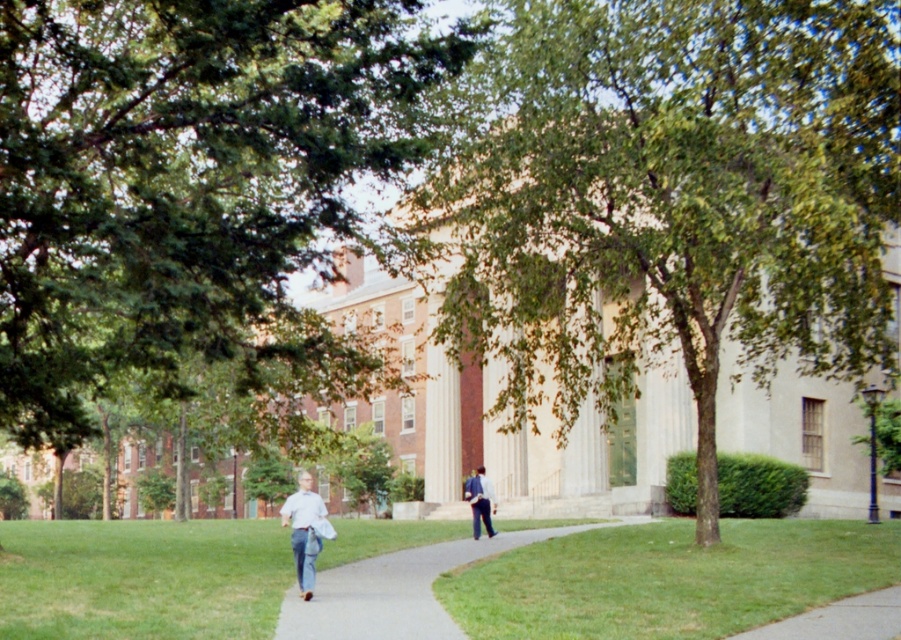
You are a student walking on the gray concrete pavement at lower right and want to reach the green leafy tree at center. Which direction should you move to get there?

To reach the green leafy tree at center from the gray concrete pavement at lower right, you should move upward, as the tree is located above the pavement.